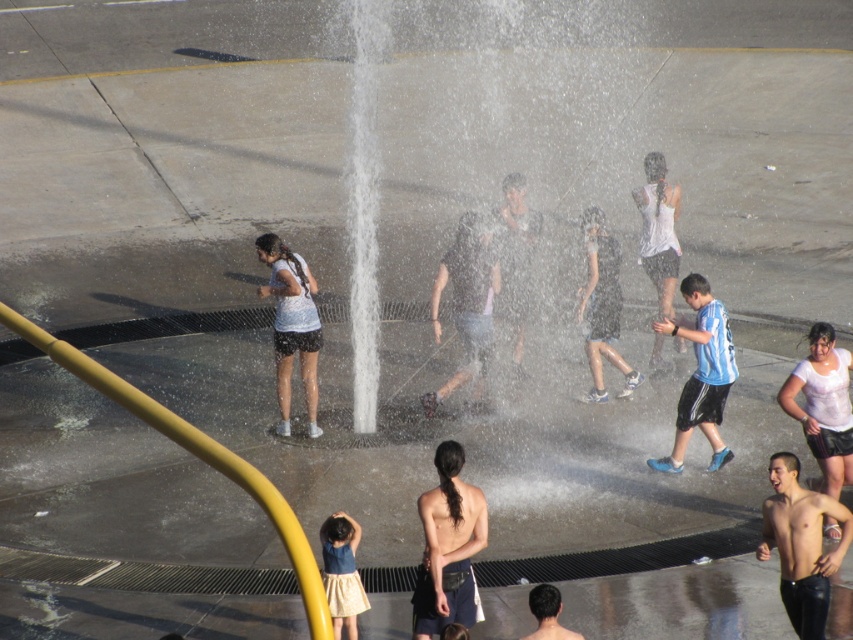
You are a photographer trying to capture a group photo of the blue striped shirt at center and the white matte shirt at center. If you want to ensure both shirts are fully visible in the frame, which shirt should you focus on to avoid cropping?

You should focus on the blue striped shirt at center because it has a larger width than the white matte shirt at center, so ensuring it fits properly will automatically accommodate the smaller one.

You are a photographer standing at the edge of the fountain. You want to take a photo that includes both the smooth skin torso at lower right and the white matte shorts at center. Given that your camera has a maximum focal length that allows capturing objects up to 5 meters apart in the frame, will you be able to include both subjects in the same photo?

The smooth skin torso at lower right and white matte shorts at center are 4.89 meters apart from each other. Since 4.89 meters is less than the 5 meters maximum focal length, you can include both subjects in the same photo.